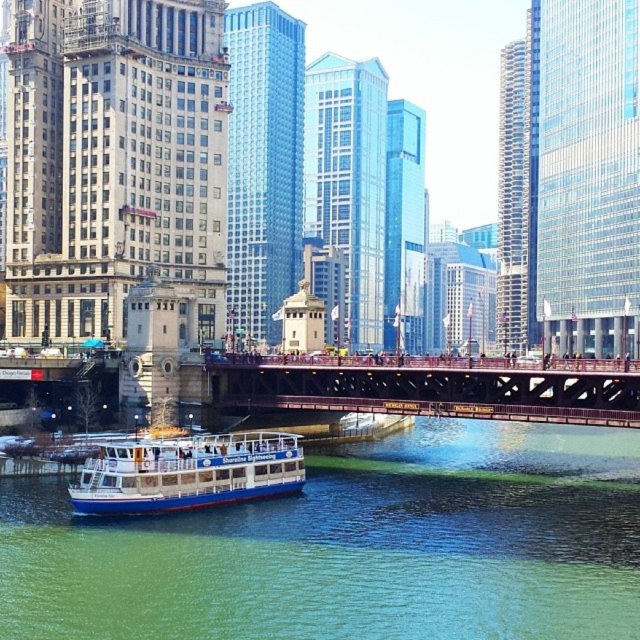
You are a photographer standing on the red bridge in the midground. You want to capture a photo that includes both the green water at lower left and the white glossy boat at lower center. Which object will appear closer to the bottom edge of your photo?

The green water at lower left will appear closer to the bottom edge of the photo because it has a lesser height compared to the white glossy boat at lower center.

You are standing at the point labeled as point [355,547]. What can you see in the direction of the green water at lower left from your current position?

The point [355,547] indicates green water at lower left, so you are already at the green water at lower left and cannot see it in any direction from there.